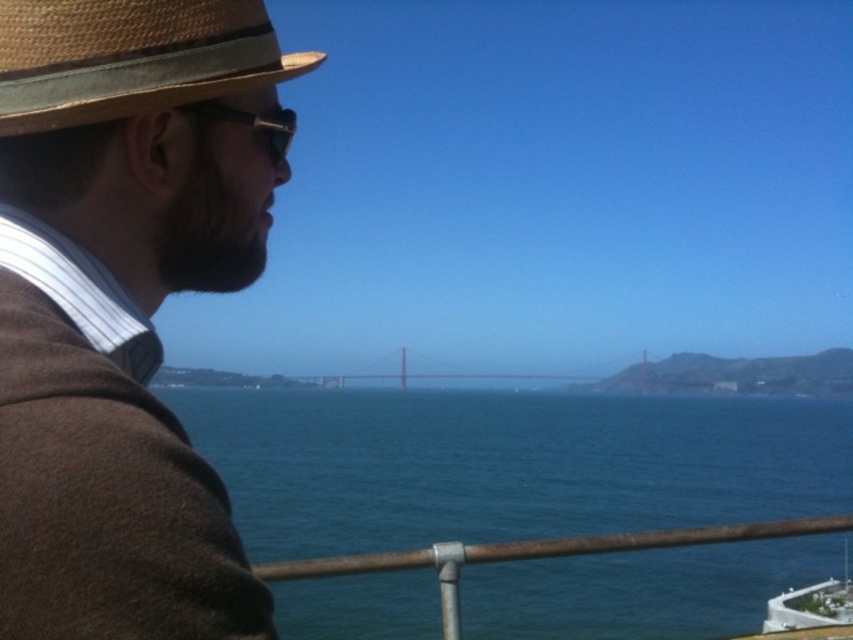
Question: Can you confirm if blue water at center is bigger than rusty metal rail at lower center?

Choices:
 (A) yes
 (B) no

Answer: (A)

Question: Considering the relative positions of blue water at center and rusty metal rail at lower center in the image provided, where is blue water at center located with respect to rusty metal rail at lower center?

Choices:
 (A) below
 (B) above

Answer: (A)

Question: Which object appears farthest from the camera in this image?

Choices:
 (A) rusty metal rail at lower center
 (B) blue water at center

Answer: (B)

Question: Can you confirm if blue water at center is wider than rusty metal rail at lower center?

Choices:
 (A) yes
 (B) no

Answer: (A)

Question: Which point is closer to the camera?

Choices:
 (A) blue water at center
 (B) rusty metal rail at lower center

Answer: (B)